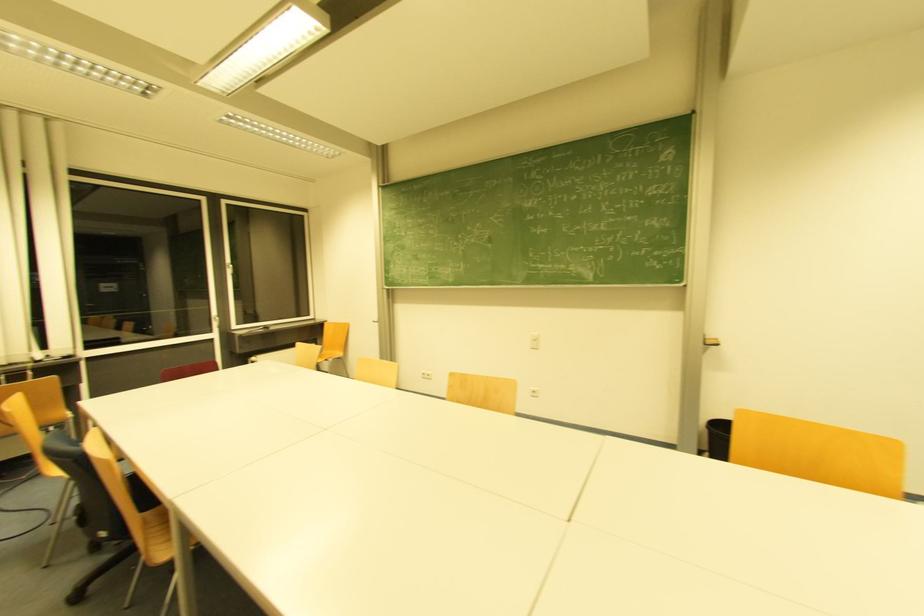
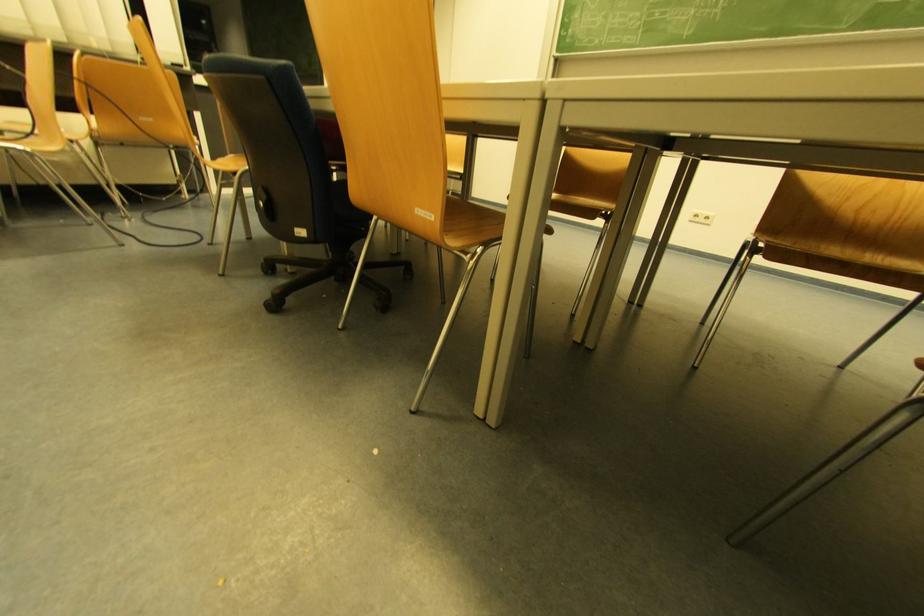
What movement of the cameraman would produce the second image?

The cameraman walked toward left, forward.